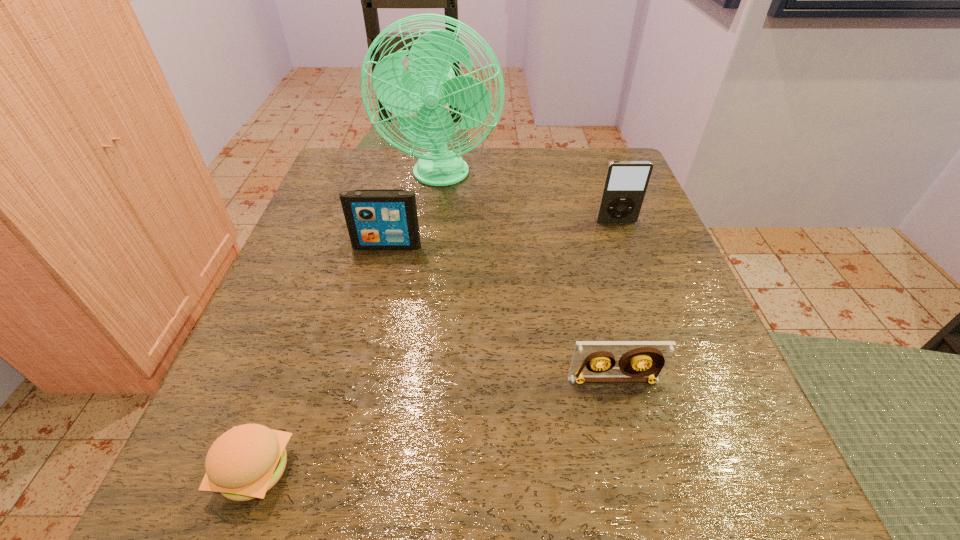
Locate an element on the screen. free space between the left iPod and the fourth tallest object is located at coordinates (500, 313).

Identify which object is the fourth closest to the fourth nearest object. Please provide its 2D coordinates. Your answer should be formatted as a tuple, i.e. [(x, y)], where the tuple contains the x and y coordinates of a point satisfying the conditions above.

[(245, 462)]

Identify the location of object that is the second closest one to the third farthest object. (625, 184).